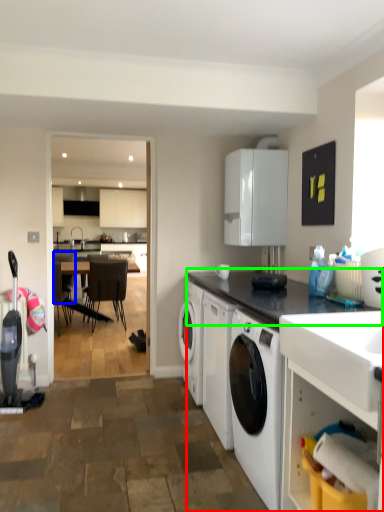
Question: Which is nearer to the countertop (highlighted by a red box)? chair (highlighted by a blue box) or countertop (highlighted by a green box).

Choices:
 (A) chair
 (B) countertop

Answer: (B)